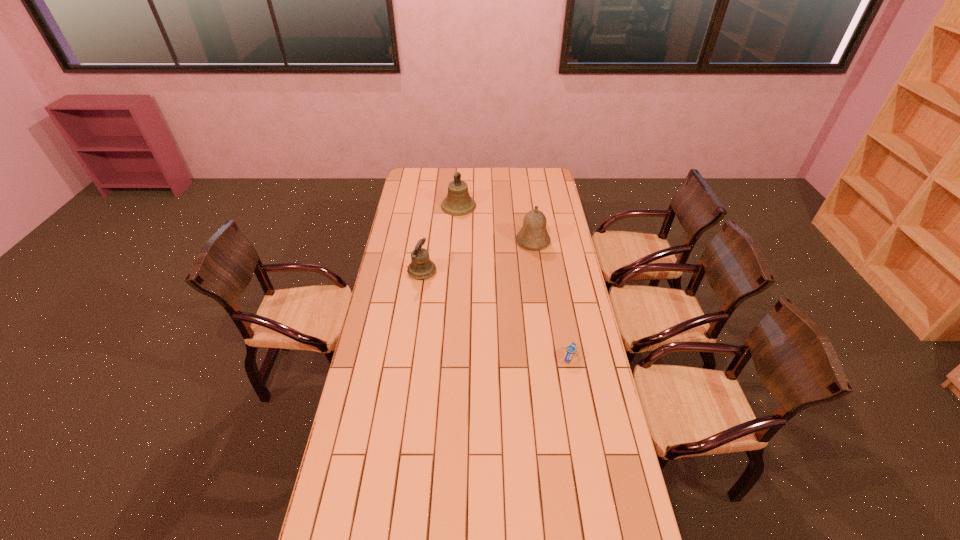
Identify which bell is the nearest to the rightmost bell. Please provide its 2D coordinates. Your answer should be formatted as a tuple, i.e. [(x, y)], where the tuple contains the x and y coordinates of a point satisfying the conditions above.

[(458, 202)]